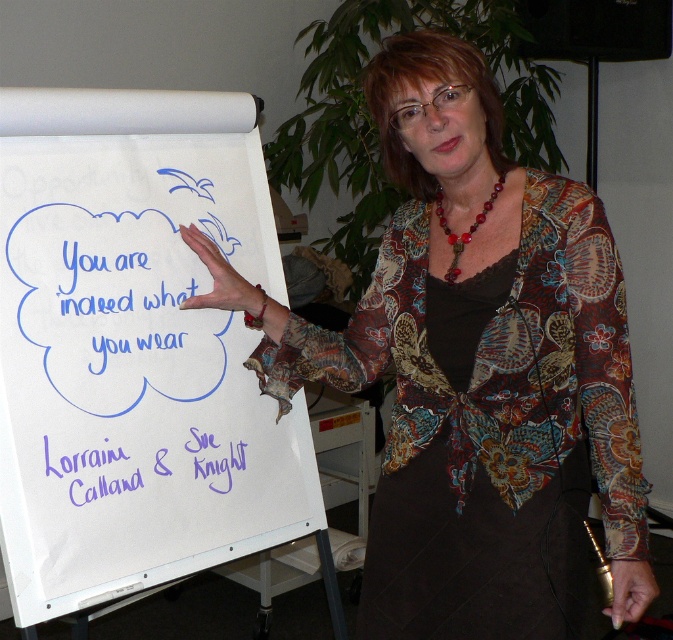
Question: Which of these objects is positioned farthest from the white paperboard at center?

Choices:
 (A) floral-patterned blouse at center
 (B) blue marker text at center

Answer: (A)

Question: Does white paperboard at center appear over blue marker text at center?

Choices:
 (A) no
 (B) yes

Answer: (A)

Question: Which point appears closest to the camera in this image?

Choices:
 (A) (306, 428)
 (B) (170, 337)
 (C) (600, 385)

Answer: (C)

Question: Does white paperboard at center appear on the left side of blue marker text at center?

Choices:
 (A) no
 (B) yes

Answer: (A)

Question: From the image, what is the correct spatial relationship of floral-patterned blouse at center in relation to blue marker text at center?

Choices:
 (A) above
 (B) below

Answer: (B)

Question: Among these points, which one is farthest from the camera?

Choices:
 (A) (81, 330)
 (B) (141, 372)
 (C) (623, 292)

Answer: (B)